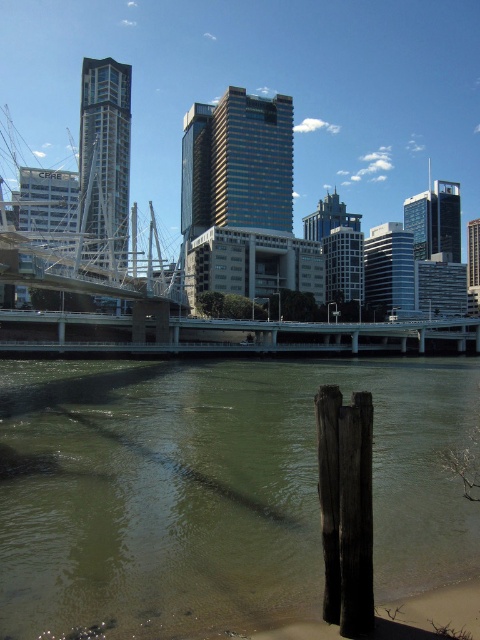
Question: Is brown wood post at lower right smaller than concrete bridge at center?

Choices:
 (A) yes
 (B) no

Answer: (A)

Question: Can you confirm if brown wood post at lower right is wider than concrete bridge at center?

Choices:
 (A) no
 (B) yes

Answer: (A)

Question: Can you confirm if brown wood post at lower right is positioned to the right of concrete bridge at center?

Choices:
 (A) yes
 (B) no

Answer: (B)

Question: Among these points, which one is nearest to the camera?

Choices:
 (A) (40, 346)
 (B) (199, 600)

Answer: (B)

Question: Among these objects, which one is farthest from the camera?

Choices:
 (A) brown wood post at lower right
 (B) concrete bridge at center

Answer: (B)